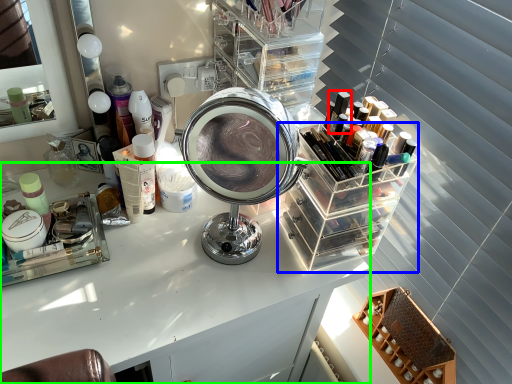
Question: Which is nearer to the toiletry (highlighted by a red box)? glass box (highlighted by a blue box) or table (highlighted by a green box).

Choices:
 (A) glass box
 (B) table

Answer: (A)